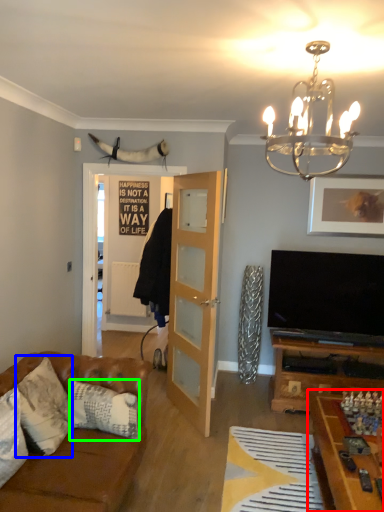
Question: Which object is positioned farthest from table (highlighted by a red box)? Select from pillow (highlighted by a blue box) and pillow (highlighted by a green box).

Choices:
 (A) pillow
 (B) pillow

Answer: (A)